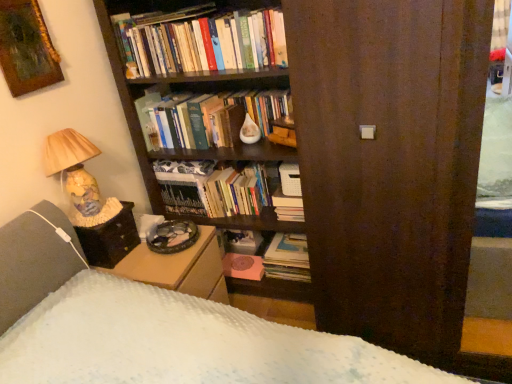
I want to click on free space above black fabric table at lower left (from a real-world perspective), so click(98, 213).